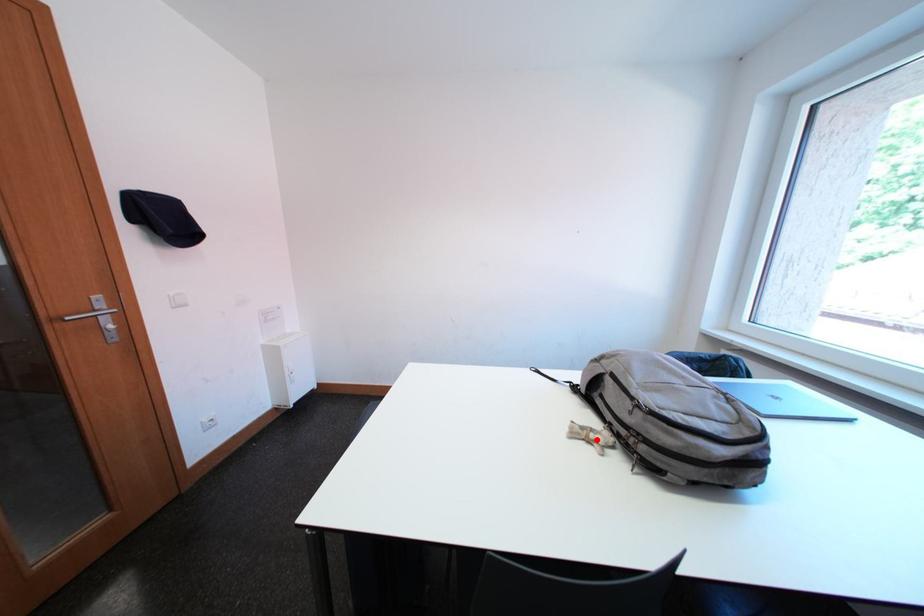
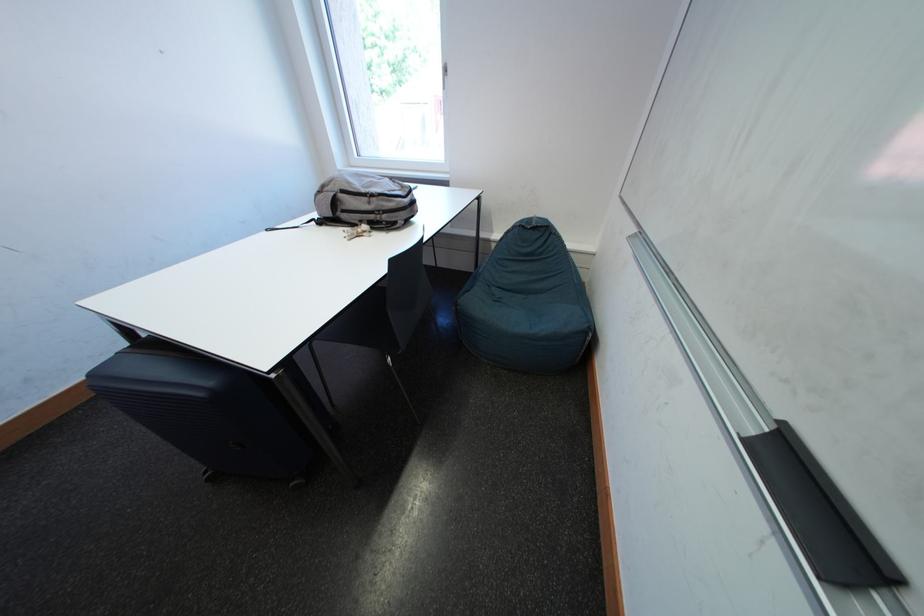
Find the pixel in the second image that matches the highlighted location in the first image.

(368, 236)